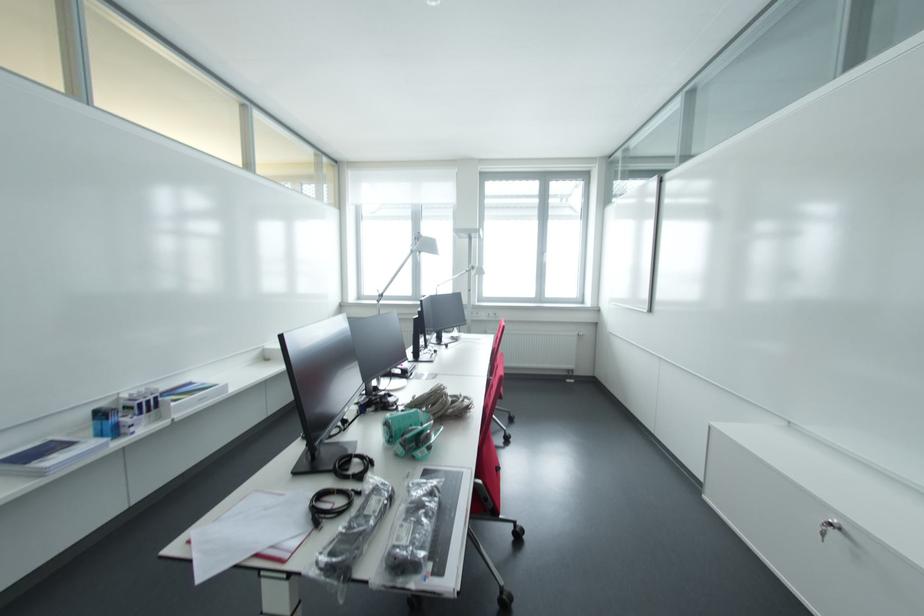
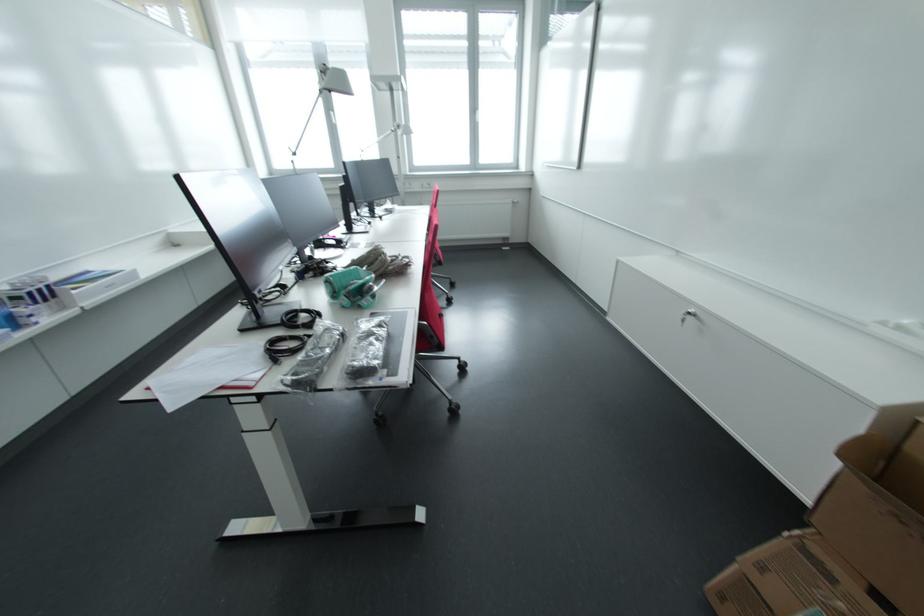
In the second image, find the point that corresponds to the point at 423,456 in the first image.

(369, 304)